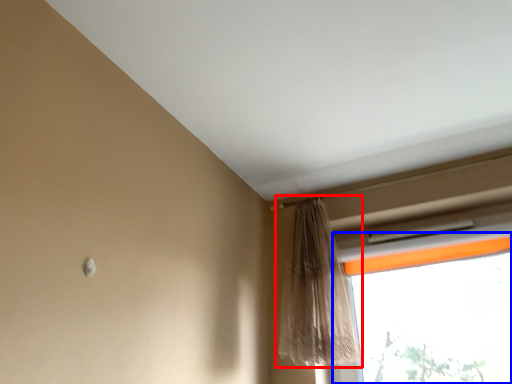
Question: Among these objects, which one is nearest to the camera, curtain (highlighted by a red box) or window (highlighted by a blue box)?

Choices:
 (A) curtain
 (B) window

Answer: (A)